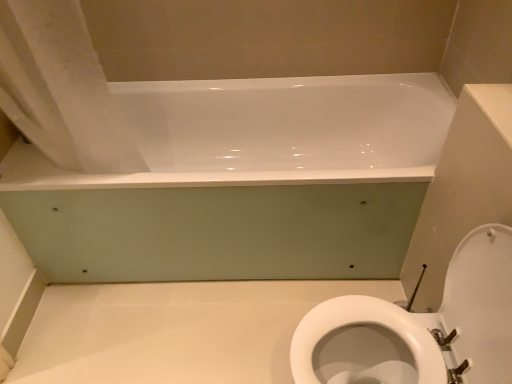
Question: Does white glossy toilet at lower right have a greater width compared to white glossy bathtub at upper center?

Choices:
 (A) no
 (B) yes

Answer: (A)

Question: Is white glossy toilet at lower right aimed at white glossy bathtub at upper center?

Choices:
 (A) yes
 (B) no

Answer: (B)

Question: From a real-world perspective, does white glossy toilet at lower right stand above white glossy bathtub at upper center?

Choices:
 (A) no
 (B) yes

Answer: (B)

Question: Considering the relative positions of white glossy toilet at lower right and white glossy bathtub at upper center in the image provided, is white glossy toilet at lower right to the right of white glossy bathtub at upper center from the viewer's perspective?

Choices:
 (A) yes
 (B) no

Answer: (A)

Question: Is white glossy toilet at lower right to the left of white glossy bathtub at upper center from the viewer's perspective?

Choices:
 (A) no
 (B) yes

Answer: (A)

Question: Does white glossy toilet at lower right have a smaller size compared to white glossy bathtub at upper center?

Choices:
 (A) yes
 (B) no

Answer: (A)

Question: Is the surface of white fabric shower curtain at upper left in direct contact with white glossy bathtub at upper center?

Choices:
 (A) yes
 (B) no

Answer: (B)

Question: Is white fabric shower curtain at upper left facing towards white glossy bathtub at upper center?

Choices:
 (A) no
 (B) yes

Answer: (A)

Question: From a real-world perspective, is white fabric shower curtain at upper left positioned over white glossy bathtub at upper center based on gravity?

Choices:
 (A) yes
 (B) no

Answer: (A)

Question: Is white fabric shower curtain at upper left oriented away from white glossy bathtub at upper center?

Choices:
 (A) yes
 (B) no

Answer: (B)

Question: From the image's perspective, is white fabric shower curtain at upper left below white glossy bathtub at upper center?

Choices:
 (A) yes
 (B) no

Answer: (B)

Question: Does white fabric shower curtain at upper left come in front of white glossy bathtub at upper center?

Choices:
 (A) no
 (B) yes

Answer: (B)

Question: From a real-world perspective, is white glossy toilet at lower right located higher than white fabric shower curtain at upper left?

Choices:
 (A) yes
 (B) no

Answer: (B)